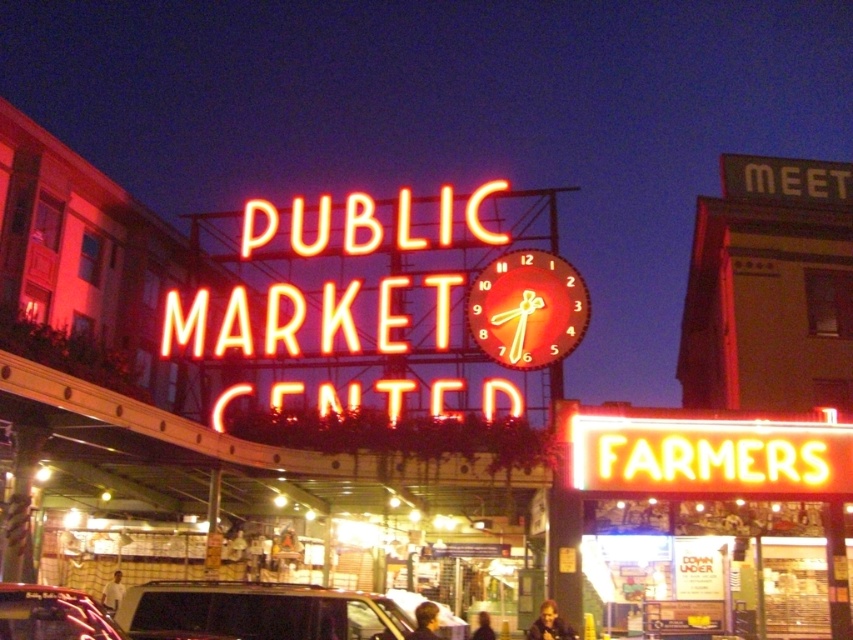
Can you confirm if dark gray metallic suv at center is smaller than neon illuminated clock at center?

Incorrect, dark gray metallic suv at center is not smaller in size than neon illuminated clock at center.

Between dark gray metallic suv at center and neon illuminated clock at center, which one has more height?

Standing taller between the two is neon illuminated clock at center.

This screenshot has height=640, width=853. What are the coordinates of `dark gray metallic suv at center` in the screenshot? It's located at (260, 611).

This screenshot has width=853, height=640. In order to click on dark gray metallic suv at center in this screenshot , I will do `click(260, 611)`.

Does neon illuminated clock at center come behind metallic red car at lower left?

Yes, it is.

Is neon illuminated clock at center shorter than metallic red car at lower left?

Indeed, neon illuminated clock at center has a lesser height compared to metallic red car at lower left.

Which is behind, point (579, 292) or point (102, 611)?

The point (579, 292) is behind.

Locate an element on the screen. neon illuminated clock at center is located at coordinates click(x=527, y=308).

Who is lower down, dark gray metallic suv at center or metallic red car at lower left?

Positioned lower is dark gray metallic suv at center.

Can you confirm if dark gray metallic suv at center is positioned below metallic red car at lower left?

Correct, dark gray metallic suv at center is located below metallic red car at lower left.

Is point (181, 625) positioned before point (9, 600)?

That is False.

Image resolution: width=853 pixels, height=640 pixels. Identify the location of dark gray metallic suv at center. (260, 611).